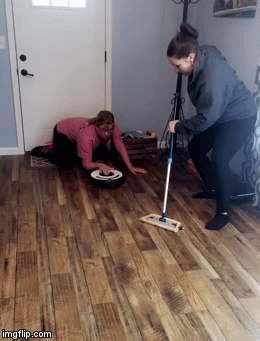
The height and width of the screenshot is (341, 260). What are the coordinates of `black deadbolt` in the screenshot? It's located at (23, 57).